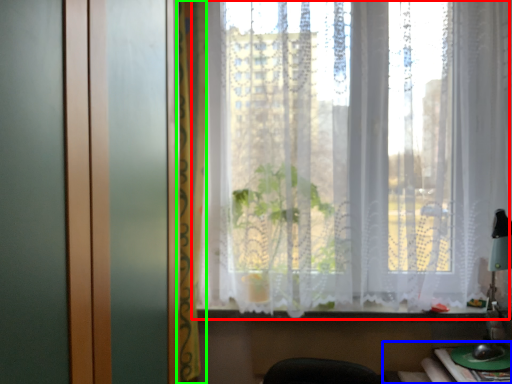
Question: Which is farther away from curtain (highlighted by a red box)? table (highlighted by a blue box) or curtain (highlighted by a green box)?

Choices:
 (A) table
 (B) curtain

Answer: (A)